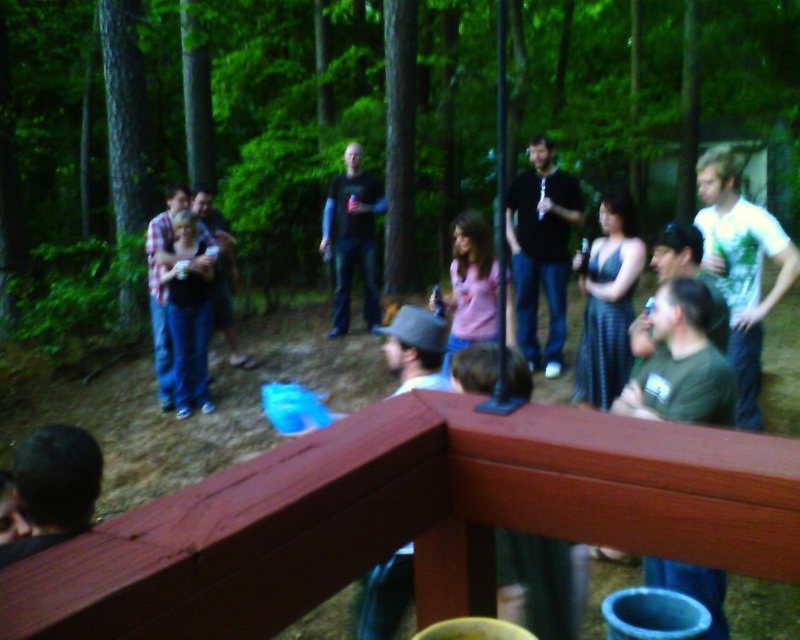
You are standing at the wooden structure in the foreground and want to throw a ball to a friend. There are two points marked in the image, point A at coordinates point (88, 456) and point B at coordinates point (164, 355). Which point should you aim for if you want the ball to land closer to the camera?

Point A at coordinates point (88, 456) is closer to the camera than point B at coordinates point (164, 355), so you should aim for point A to have the ball land closer to the camera.